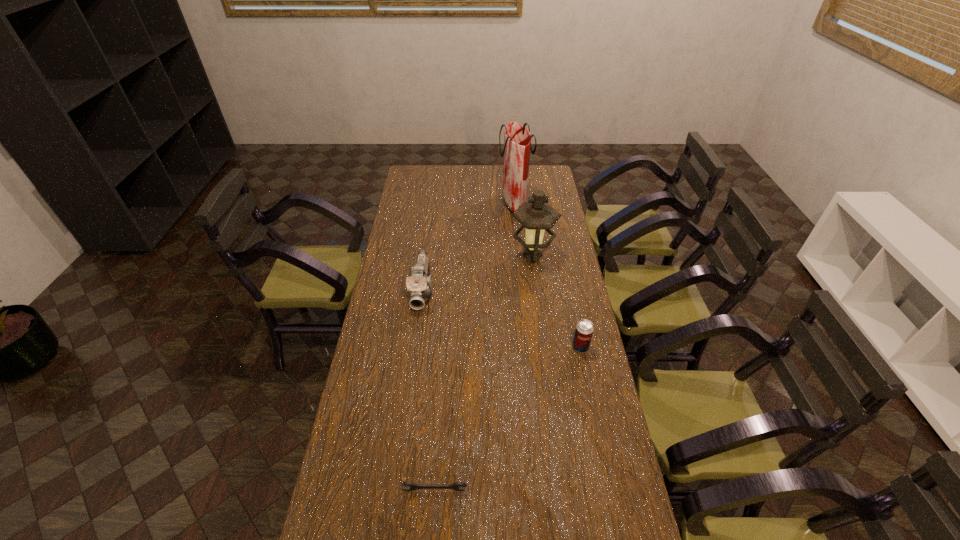
Where is `vacant space located on the front of the farthest object`? Image resolution: width=960 pixels, height=540 pixels. vacant space located on the front of the farthest object is located at coordinates (516, 235).

At what (x,y) coordinates should I click in order to perform the action: click on blank space located 0.360m on the left of the fourth nearest object. Please return your answer as a coordinate pair (x, y). Image resolution: width=960 pixels, height=540 pixels. Looking at the image, I should click on (430, 256).

Identify the location of blank area located on the front-facing side of the third nearest object. The image size is (960, 540). (412, 368).

I want to click on blank space located on the front of the fourth tallest object, so click(605, 464).

This screenshot has height=540, width=960. Find the location of `free space located 0.090m on the open ends of the wrench`. free space located 0.090m on the open ends of the wrench is located at coordinates (432, 526).

Locate an element on the screen. The height and width of the screenshot is (540, 960). object at the left edge is located at coordinates (419, 285).

Locate an element on the screen. This screenshot has height=540, width=960. grocery bag at the right edge is located at coordinates pyautogui.click(x=517, y=140).

This screenshot has height=540, width=960. I want to click on oil lamp located at the right edge, so click(536, 215).

What are the coordinates of `beer can present at the right edge` in the screenshot? It's located at (584, 329).

You are a GUI agent. You are given a task and a screenshot of the screen. Output one action in this format:
    pyautogui.click(x=<x>, y=<y>)
    Task: Click on the vacant point at the left edge
    The height and width of the screenshot is (540, 960).
    Given the screenshot: What is the action you would take?
    pyautogui.click(x=386, y=290)